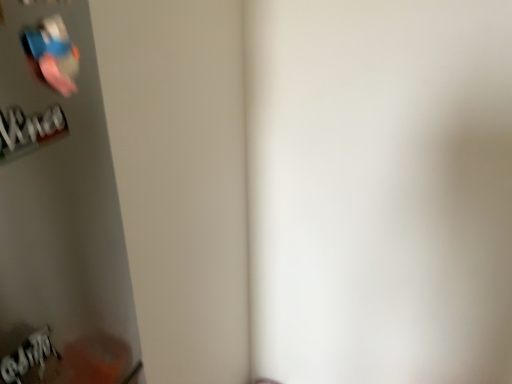
This screenshot has height=384, width=512. What are the coordinates of `white paper at lower left, the second writing in the top-to-bottom sequence` in the screenshot? It's located at (31, 360).

Measure the distance between point [61,70] and camera.

Point [61,70] is 16.69 inches from camera.

Describe the element at coordinates (51, 54) in the screenshot. I see `metallic blue wii remote at upper left` at that location.

Describe the element at coordinates (29, 128) in the screenshot. I see `white paper at left, marked as the first writing in a top-to-bottom arrangement` at that location.

In order to click on white paper at lower left, the second writing in the top-to-bottom sequence in this screenshot , I will do `click(31, 360)`.

From the image's perspective, which one is positioned lower, white paper at lower left, the 1th writing in the bottom-to-top sequence, or metallic blue wii remote at upper left?

white paper at lower left, the 1th writing in the bottom-to-top sequence, is shown below in the image.

Is white paper at lower left, the second writing in the top-to-bottom sequence, oriented towards metallic blue wii remote at upper left?

No, white paper at lower left, the second writing in the top-to-bottom sequence, is not facing towards metallic blue wii remote at upper left.

Considering the positions of points (54, 352) and (42, 79), is point (54, 352) farther from camera compared to point (42, 79)?

Yes, point (54, 352) is farther from viewer.

Looking at this image, from a real-world perspective, does white paper at lower left, the 1th writing in the bottom-to-top sequence, stand above metallic blue wii remote at upper left?

No.

Which object is thinner, white paper at left, which is the 2th writing from bottom to top, or white paper at lower left, the 1th writing in the bottom-to-top sequence?

With smaller width is white paper at left, which is the 2th writing from bottom to top.

Is there a large distance between white paper at left, which is the 2th writing from bottom to top, and white paper at lower left, the second writing in the top-to-bottom sequence?

white paper at left, which is the 2th writing from bottom to top, is near white paper at lower left, the second writing in the top-to-bottom sequence, not far away.

Considering the positions of points (45, 131) and (25, 377), is point (45, 131) closer to camera compared to point (25, 377)?

That is True.

Could you tell me if white paper at left, which is the 2th writing from bottom to top, is facing white paper at lower left, the 1th writing in the bottom-to-top sequence?

No.

Considering the positions of objects metallic blue wii remote at upper left and white paper at left, marked as the first writing in a top-to-bottom arrangement, in the image provided, who is in front, metallic blue wii remote at upper left or white paper at left, marked as the first writing in a top-to-bottom arrangement,?

white paper at left, marked as the first writing in a top-to-bottom arrangement, is more forward.

Considering the sizes of objects metallic blue wii remote at upper left and white paper at left, marked as the first writing in a top-to-bottom arrangement, in the image provided, who is taller, metallic blue wii remote at upper left or white paper at left, marked as the first writing in a top-to-bottom arrangement,?

metallic blue wii remote at upper left is taller.

Is metallic blue wii remote at upper left wider or thinner than white paper at left, which is the 2th writing from bottom to top?

metallic blue wii remote at upper left is thinner than white paper at left, which is the 2th writing from bottom to top.

Is metallic blue wii remote at upper left oriented towards white paper at lower left, the second writing in the top-to-bottom sequence?

No, metallic blue wii remote at upper left is not facing towards white paper at lower left, the second writing in the top-to-bottom sequence.

Does metallic blue wii remote at upper left have a greater width compared to white paper at lower left, the second writing in the top-to-bottom sequence?

Incorrect, the width of metallic blue wii remote at upper left does not surpass that of white paper at lower left, the second writing in the top-to-bottom sequence.

From the image's perspective, is metallic blue wii remote at upper left on top of white paper at lower left, the 1th writing in the bottom-to-top sequence?

Yes, from the image's perspective, metallic blue wii remote at upper left is on top of white paper at lower left, the 1th writing in the bottom-to-top sequence.

Can you see metallic blue wii remote at upper left touching white paper at lower left, the second writing in the top-to-bottom sequence?

No, metallic blue wii remote at upper left is not next to white paper at lower left, the second writing in the top-to-bottom sequence.

From the image's perspective, is white paper at lower left, the 1th writing in the bottom-to-top sequence, located above white paper at left, which is the 2th writing from bottom to top?

No, from the image's perspective, white paper at lower left, the 1th writing in the bottom-to-top sequence, is not on top of white paper at left, which is the 2th writing from bottom to top.

Is white paper at left, marked as the first writing in a top-to-bottom arrangement, completely or partially inside white paper at lower left, the second writing in the top-to-bottom sequence?

No, white paper at left, marked as the first writing in a top-to-bottom arrangement, is located outside of white paper at lower left, the second writing in the top-to-bottom sequence.

From a real-world perspective, is white paper at lower left, the 1th writing in the bottom-to-top sequence, physically below white paper at left, marked as the first writing in a top-to-bottom arrangement?

Indeed, from a real-world perspective, white paper at lower left, the 1th writing in the bottom-to-top sequence, is positioned beneath white paper at left, marked as the first writing in a top-to-bottom arrangement.

From a real-world perspective, is white paper at left, marked as the first writing in a top-to-bottom arrangement, below metallic blue wii remote at upper left?

Indeed, from a real-world perspective, white paper at left, marked as the first writing in a top-to-bottom arrangement, is positioned beneath metallic blue wii remote at upper left.

Which of these two, white paper at left, which is the 2th writing from bottom to top, or metallic blue wii remote at upper left, is bigger?

Bigger between the two is white paper at left, which is the 2th writing from bottom to top.

Is white paper at left, which is the 2th writing from bottom to top, in front of or behind metallic blue wii remote at upper left in the image?

In the image, white paper at left, which is the 2th writing from bottom to top, appears in front of metallic blue wii remote at upper left.

Identify the location of the 2nd writing to the left of the metallic blue wii remote at upper left, starting your count from the anchor. The image size is (512, 384). (31, 360).

Find the location of `writing below the white paper at left, which is the 2th writing from bottom to top (from a real-world perspective)`. writing below the white paper at left, which is the 2th writing from bottom to top (from a real-world perspective) is located at coordinates (31, 360).

Considering their positions, is white paper at left, marked as the first writing in a top-to-bottom arrangement, positioned closer to metallic blue wii remote at upper left than white paper at lower left, the second writing in the top-to-bottom sequence?

white paper at left, marked as the first writing in a top-to-bottom arrangement, is positioned closer to the anchor metallic blue wii remote at upper left.

When comparing their distances from white paper at left, which is the 2th writing from bottom to top, does metallic blue wii remote at upper left or white paper at lower left, the 1th writing in the bottom-to-top sequence, seem closer?

Based on the image, metallic blue wii remote at upper left appears to be nearer to white paper at left, which is the 2th writing from bottom to top.

Considering their positions, is white paper at lower left, the 1th writing in the bottom-to-top sequence, positioned further to metallic blue wii remote at upper left than white paper at left, marked as the first writing in a top-to-bottom arrangement?

white paper at lower left, the 1th writing in the bottom-to-top sequence, lies further to metallic blue wii remote at upper left than the other object.

Considering their positions, is white paper at left, marked as the first writing in a top-to-bottom arrangement, positioned closer to white paper at lower left, the 1th writing in the bottom-to-top sequence, than metallic blue wii remote at upper left?

Based on the image, white paper at left, marked as the first writing in a top-to-bottom arrangement, appears to be nearer to white paper at lower left, the 1th writing in the bottom-to-top sequence.

Looking at the image, which one is located closer to white paper at left, marked as the first writing in a top-to-bottom arrangement, white paper at lower left, the second writing in the top-to-bottom sequence, or metallic blue wii remote at upper left?

metallic blue wii remote at upper left is positioned closer to the anchor white paper at left, marked as the first writing in a top-to-bottom arrangement.

Estimate the real-world distances between objects in this image. Which object is further from white paper at lower left, the 1th writing in the bottom-to-top sequence, metallic blue wii remote at upper left or white paper at left, marked as the first writing in a top-to-bottom arrangement?

metallic blue wii remote at upper left is positioned further to the anchor white paper at lower left, the 1th writing in the bottom-to-top sequence.

Find the location of a particular element. The image size is (512, 384). writing between metallic blue wii remote at upper left and white paper at lower left, the second writing in the top-to-bottom sequence, in the up-down direction is located at coordinates (29, 128).